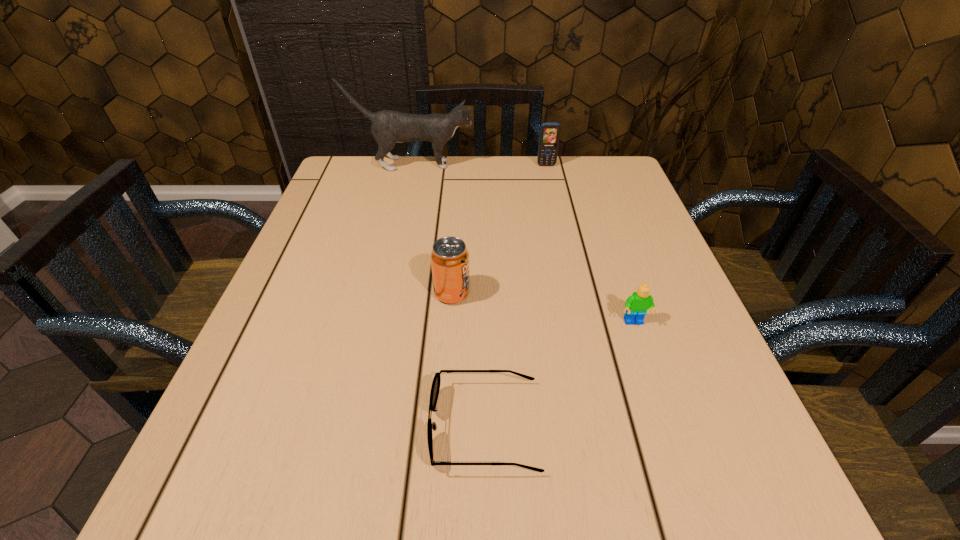
In the image, there is a desktop. In order to click on vacant region at the far edge in this screenshot , I will do `click(400, 175)`.

This screenshot has width=960, height=540. In the image, there is a desktop. Identify the location of vacant space at the near edge. (421, 481).

You are a GUI agent. You are given a task and a screenshot of the screen. Output one action in this format:
    pyautogui.click(x=<x>, y=<y>)
    Task: Click on the free space at the left edge
    This screenshot has width=960, height=540.
    Given the screenshot: What is the action you would take?
    pyautogui.click(x=336, y=282)

In the image, there is a desktop. Where is `free space at the right edge`? The width and height of the screenshot is (960, 540). free space at the right edge is located at coordinates (625, 332).

Where is `blank space at the far left corner`? The height and width of the screenshot is (540, 960). blank space at the far left corner is located at coordinates (359, 166).

The width and height of the screenshot is (960, 540). In the image, there is a desktop. Find the location of `free space at the far right corner`. free space at the far right corner is located at coordinates (584, 184).

Locate an element on the screen. The image size is (960, 540). free spot at the near right corner of the desktop is located at coordinates (711, 483).

Identify the location of vacant space in between the nearest object and the third farthest object. (468, 360).

Where is `free space that is in between the fourth tallest object and the third farthest object`? free space that is in between the fourth tallest object and the third farthest object is located at coordinates (543, 308).

You are a GUI agent. You are given a task and a screenshot of the screen. Output one action in this format:
    pyautogui.click(x=<x>, y=<y>)
    Task: Click on the vacant space in between the cat and the second shortest object
    The height and width of the screenshot is (540, 960).
    Given the screenshot: What is the action you would take?
    pyautogui.click(x=523, y=244)